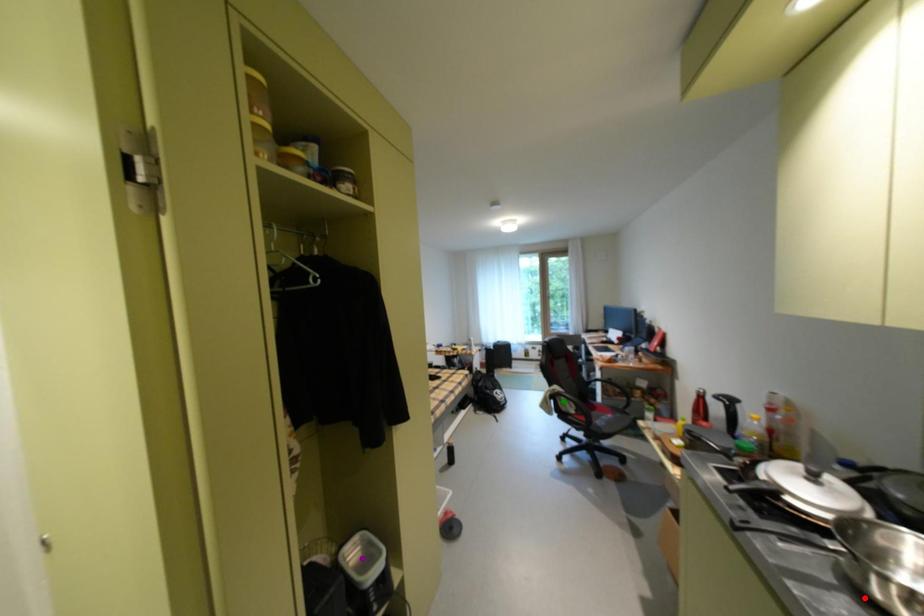
Order these from nearest to farthest:
A) green point
B) purple point
C) red point

A: green point < purple point < red point